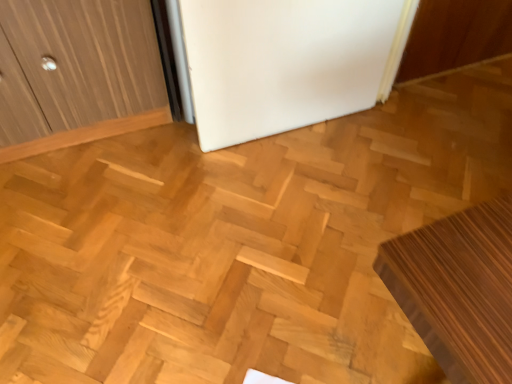
The image size is (512, 384). I want to click on white matte refrigerator at center, so click(286, 62).

Measure the distance between white matte refrigerator at center and camera.

A distance of 4.11 feet exists between white matte refrigerator at center and camera.

This screenshot has height=384, width=512. What do you see at coordinates (286, 62) in the screenshot?
I see `white matte refrigerator at center` at bounding box center [286, 62].

Measure the distance between point (342,67) and camera.

A distance of 1.70 meters exists between point (342,67) and camera.

Image resolution: width=512 pixels, height=384 pixels. Describe the element at coordinates (458, 289) in the screenshot. I see `wooden bench at lower right` at that location.

Where is `wooden bench at lower right`? The width and height of the screenshot is (512, 384). wooden bench at lower right is located at coordinates (458, 289).

In the scene shown: Measure the distance between point (484, 337) and camera.

The depth of point (484, 337) is 25.28 inches.

Where is `white matte refrigerator at center`? white matte refrigerator at center is located at coordinates (286, 62).

Looking at this image, is wooden bench at lower right at the left side of white matte refrigerator at center?

No.

Which object is further away from the camera taking this photo, wooden bench at lower right or white matte refrigerator at center?

white matte refrigerator at center is further from the camera.

Is point (463, 366) positioned in front of point (207, 18)?

Yes.

From the image's perspective, who appears lower, wooden bench at lower right or white matte refrigerator at center?

wooden bench at lower right appears lower in the image.

Consider the image. From a real-world perspective, which object stands above the other?

In real-world perspective, white matte refrigerator at center is above.

Which object is wider, wooden bench at lower right or white matte refrigerator at center?

Wider between the two is wooden bench at lower right.

Is wooden bench at lower right shorter than white matte refrigerator at center?

Yes.

Based on their sizes in the image, would you say wooden bench at lower right is bigger or smaller than white matte refrigerator at center?

Considering their sizes, wooden bench at lower right takes up more space than white matte refrigerator at center.

Would you say white matte refrigerator at center is part of wooden bench at lower right's contents?

Actually, white matte refrigerator at center is outside wooden bench at lower right.

Is wooden bench at lower right in contact with white matte refrigerator at center?

wooden bench at lower right and white matte refrigerator at center are clearly separated.

Is wooden bench at lower right oriented away from white matte refrigerator at center?

That's not correct — wooden bench at lower right is not looking away from white matte refrigerator at center.

Can you tell me how much wooden bench at lower right and white matte refrigerator at center differ in facing direction?

They differ by 93.9 degrees in their facing directions.

Locate an element on the screen. The width and height of the screenshot is (512, 384). furniture lying in front of the white matte refrigerator at center is located at coordinates (458, 289).

In the scene shown: Can you confirm if white matte refrigerator at center is positioned to the left of wooden bench at lower right?

Yes, white matte refrigerator at center is to the left of wooden bench at lower right.

Relative to wooden bench at lower right, is white matte refrigerator at center in front or behind?

Visually, white matte refrigerator at center is located behind wooden bench at lower right.

Is point (219, 136) closer or farther from the camera than point (451, 306)?

Point (219, 136) is positioned farther from the camera compared to point (451, 306).

From the image's perspective, between white matte refrigerator at center and wooden bench at lower right, which one is located above?

white matte refrigerator at center.

From a real-world perspective, relative to wooden bench at lower right, is white matte refrigerator at center vertically above or below?

white matte refrigerator at center is above wooden bench at lower right.

In the scene shown: Considering the relative sizes of white matte refrigerator at center and wooden bench at lower right in the image provided, is white matte refrigerator at center wider than wooden bench at lower right?

Incorrect, the width of white matte refrigerator at center does not surpass that of wooden bench at lower right.

Who is taller, white matte refrigerator at center or wooden bench at lower right?

white matte refrigerator at center.

Consider the image. Who is smaller, white matte refrigerator at center or wooden bench at lower right?

white matte refrigerator at center.

From the picture: Do you think white matte refrigerator at center is within wooden bench at lower right, or outside of it?

The correct answer is: outside.

Are white matte refrigerator at center and wooden bench at lower right beside each other?

No.

Is white matte refrigerator at center positioned with its back to wooden bench at lower right?

No.

Looking at this image, can you tell me how much white matte refrigerator at center and wooden bench at lower right differ in facing direction?

They differ by 93.9 degrees in their facing directions.

Image resolution: width=512 pixels, height=384 pixels. There is a wooden bench at lower right. Find the location of `fridge above it (from a real-world perspective)`. fridge above it (from a real-world perspective) is located at coordinates (286, 62).

The image size is (512, 384). Identify the location of furniture that is below the white matte refrigerator at center (from the image's perspective). (458, 289).

Where is `furniture in front of the white matte refrigerator at center`? Image resolution: width=512 pixels, height=384 pixels. furniture in front of the white matte refrigerator at center is located at coordinates (458, 289).